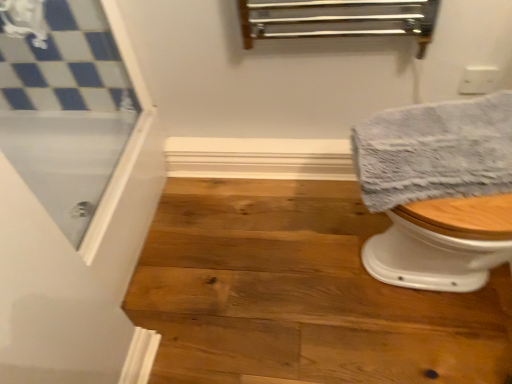
Question: From a real-world perspective, is natural wood stair at lower right over gray textured towel at right?

Choices:
 (A) no
 (B) yes

Answer: (A)

Question: Considering the relative positions of natural wood stair at lower right and gray textured towel at right in the image provided, is natural wood stair at lower right to the right of gray textured towel at right from the viewer's perspective?

Choices:
 (A) yes
 (B) no

Answer: (B)

Question: Does natural wood stair at lower right appear on the left side of gray textured towel at right?

Choices:
 (A) yes
 (B) no

Answer: (A)

Question: Does natural wood stair at lower right have a smaller size compared to gray textured towel at right?

Choices:
 (A) no
 (B) yes

Answer: (A)

Question: From the image's perspective, does natural wood stair at lower right appear higher than gray textured towel at right?

Choices:
 (A) yes
 (B) no

Answer: (B)

Question: Is clear glass screen door at upper left taller or shorter than natural wood stair at lower right?

Choices:
 (A) tall
 (B) short

Answer: (A)

Question: Is point (74, 193) positioned closer to the camera than point (420, 314)?

Choices:
 (A) farther
 (B) closer

Answer: (A)

Question: Is clear glass screen door at upper left to the left or to the right of natural wood stair at lower right in the image?

Choices:
 (A) right
 (B) left

Answer: (B)

Question: In the image, is clear glass screen door at upper left positioned in front of or behind natural wood stair at lower right?

Choices:
 (A) front
 (B) behind

Answer: (A)

Question: In terms of width, does gray textured towel at right look wider or thinner when compared to natural wood stair at lower right?

Choices:
 (A) thin
 (B) wide

Answer: (A)

Question: Is gray textured towel at right to the left or to the right of natural wood stair at lower right in the image?

Choices:
 (A) right
 (B) left

Answer: (A)

Question: From the image's perspective, is gray textured towel at right positioned above or below natural wood stair at lower right?

Choices:
 (A) below
 (B) above

Answer: (B)

Question: Does point (370, 139) appear closer or farther from the camera than point (239, 238)?

Choices:
 (A) farther
 (B) closer

Answer: (B)

Question: Considering the positions of natural wood stair at lower right and clear glass screen door at upper left in the image, is natural wood stair at lower right bigger or smaller than clear glass screen door at upper left?

Choices:
 (A) small
 (B) big

Answer: (B)

Question: Does point (259, 289) appear closer or farther from the camera than point (23, 77)?

Choices:
 (A) farther
 (B) closer

Answer: (B)